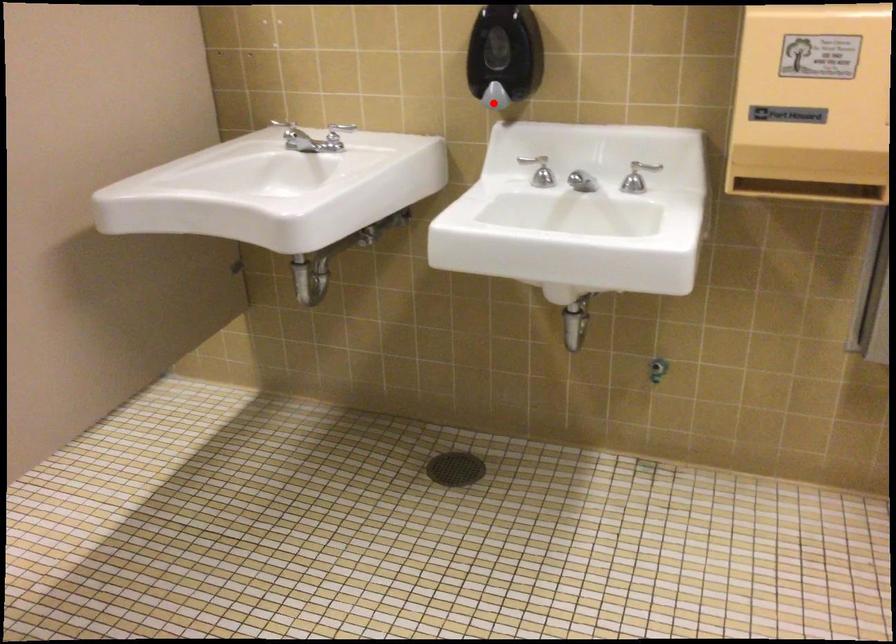
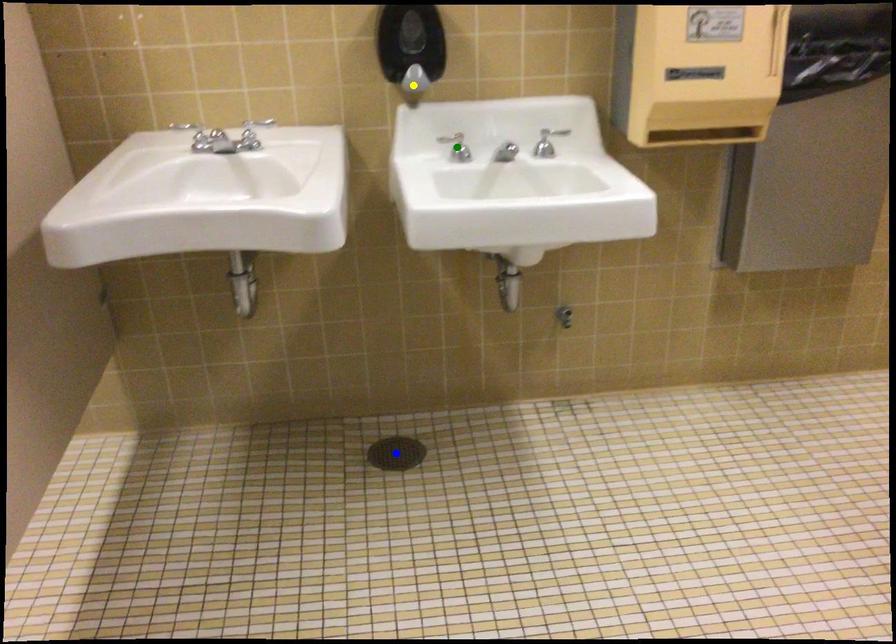
Question: I am providing you with two images of the same scene from different viewpoints. A red point is marked on the first image. You are given multiple points on the second image. Can you choose the point in image 2 that corresponds to the point in image 1?

Choices:
 (A) blue point
 (B) yellow point
 (C) green point

Answer: (B)